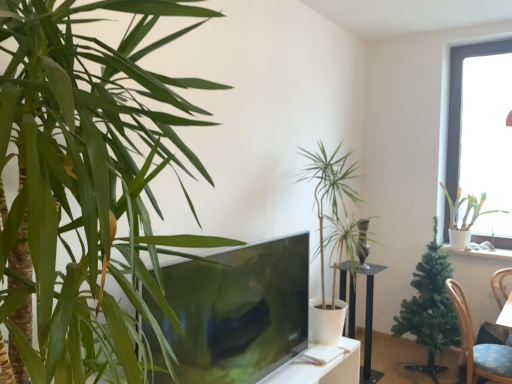
Find the location of a particular element. The image size is (512, 384). metallic black pedestal at center is located at coordinates (369, 326).

At what (x,y) coordinates should I click in order to perform the action: click on green leafy plant at left, positioned as the fourth houseplant in right-to-left order. Please return your answer as a coordinate pair (x, y). This screenshot has height=384, width=512. Looking at the image, I should click on (86, 185).

Image resolution: width=512 pixels, height=384 pixels. I want to click on transparent glass window at upper right, so click(x=482, y=134).

Locate an element on the screen. The height and width of the screenshot is (384, 512). white glossy pot at upper right, the first houseplant in the back-to-front sequence is located at coordinates (464, 216).

What do you see at coordinates (479, 345) in the screenshot? The width and height of the screenshot is (512, 384). I see `blue fabric chair at lower right` at bounding box center [479, 345].

Image resolution: width=512 pixels, height=384 pixels. In order to click on green leafy plant at center, which is the 3th houseplant from back to front in this screenshot , I will do pos(328,189).

Find the location of `metallic black pedestal at center`. metallic black pedestal at center is located at coordinates (369, 326).

Can you confirm if transparent glass window at upper right is wider than green artificial tree at right, placed as the 2th houseplant when sorted from back to front?

No, transparent glass window at upper right is not wider than green artificial tree at right, placed as the 2th houseplant when sorted from back to front.

Is transparent glass window at upper right next to green artificial tree at right, the 3th houseplant positioned from the left, and touching it?

No, transparent glass window at upper right is not touching green artificial tree at right, the 3th houseplant positioned from the left.

Can you tell me how much transparent glass window at upper right and green artificial tree at right, which appears as the third houseplant when viewed from the front, differ in facing direction?

0.414 degrees separate the facing orientations of transparent glass window at upper right and green artificial tree at right, which appears as the third houseplant when viewed from the front.

Which is in front, transparent glass window at upper right or green artificial tree at right, the 3th houseplant positioned from the left?

Positioned in front is green artificial tree at right, the 3th houseplant positioned from the left.

From the image's perspective, is white glossy pot at upper right, which appears as the 4th houseplant when viewed from the front, positioned above or below blue fabric chair at lower right?

white glossy pot at upper right, which appears as the 4th houseplant when viewed from the front, is situated higher than blue fabric chair at lower right in the image.

This screenshot has height=384, width=512. I want to click on chair on the left of white glossy pot at upper right, the first houseplant in the back-to-front sequence, so click(x=479, y=345).

Would you consider white glossy pot at upper right, which appears as the 4th houseplant when viewed from the front, to be distant from blue fabric chair at lower right?

Actually, white glossy pot at upper right, which appears as the 4th houseplant when viewed from the front, and blue fabric chair at lower right are a little close together.

Is green leafy plant at left, the 1th houseplant from the front, to the left of blue fabric chair at lower right from the viewer's perspective?

Yes, green leafy plant at left, the 1th houseplant from the front, is to the left of blue fabric chair at lower right.

From the image's perspective, which is above, green leafy plant at left, positioned as the fourth houseplant in right-to-left order, or blue fabric chair at lower right?

green leafy plant at left, positioned as the fourth houseplant in right-to-left order.

From the picture: In the image, is green leafy plant at left, which is the 1th houseplant in left-to-right order, positioned in front of or behind blue fabric chair at lower right?

green leafy plant at left, which is the 1th houseplant in left-to-right order, is in front of blue fabric chair at lower right.

Consider the image. In terms of width, does green leafy plant at left, the 4th houseplant from the back, look wider or thinner when compared to blue fabric chair at lower right?

Considering their sizes, green leafy plant at left, the 4th houseplant from the back, looks broader than blue fabric chair at lower right.

From the image's perspective, which is above, green leafy plant at left, which is the 1th houseplant in left-to-right order, or green artificial tree at right, placed as the 2th houseplant when sorted from back to front?

green leafy plant at left, which is the 1th houseplant in left-to-right order.

Who is smaller, green leafy plant at left, the 1th houseplant from the front, or green artificial tree at right, which appears as the third houseplant when viewed from the front?

green artificial tree at right, which appears as the third houseplant when viewed from the front.

Is green leafy plant at left, which is the 1th houseplant in left-to-right order, not near green artificial tree at right, arranged as the second houseplant when viewed from the right?

That's right, there is a large distance between green leafy plant at left, which is the 1th houseplant in left-to-right order, and green artificial tree at right, arranged as the second houseplant when viewed from the right.

Who is taller, green leafy plant at left, the 4th houseplant from the back, or green artificial tree at right, the 3th houseplant positioned from the left?

With more height is green leafy plant at left, the 4th houseplant from the back.

Choose the correct answer: Is green artificial tree at right, the 3th houseplant positioned from the left, inside metallic black pedestal at center or outside it?

green artificial tree at right, the 3th houseplant positioned from the left, cannot be found inside metallic black pedestal at center.

Does green artificial tree at right, arranged as the second houseplant when viewed from the right, come behind metallic black pedestal at center?

No, it is not.

Is green artificial tree at right, placed as the 2th houseplant when sorted from back to front, oriented towards metallic black pedestal at center?

No, green artificial tree at right, placed as the 2th houseplant when sorted from back to front, is not oriented towards metallic black pedestal at center.

Which object is positioned more to the right, green artificial tree at right, arranged as the second houseplant when viewed from the right, or metallic black pedestal at center?

green artificial tree at right, arranged as the second houseplant when viewed from the right.

How distant is transparent glass window at upper right from green leafy plant at center, the second houseplant from the front?

transparent glass window at upper right is 1.26 meters away from green leafy plant at center, the second houseplant from the front.

Are transparent glass window at upper right and green leafy plant at center, which ranks as the third houseplant in right-to-left order, located far from each other?

Yes.

Between transparent glass window at upper right and green leafy plant at center, which appears as the 2th houseplant when viewed from the left, which one has smaller width?

With smaller width is transparent glass window at upper right.

Is transparent glass window at upper right aimed at green leafy plant at center, which ranks as the third houseplant in right-to-left order?

No, transparent glass window at upper right is not aimed at green leafy plant at center, which ranks as the third houseplant in right-to-left order.

How far apart are green leafy plant at center, which is the 3th houseplant from back to front, and white glossy pot at upper right, the fourth houseplant viewed from the left?

green leafy plant at center, which is the 3th houseplant from back to front, is 1.18 meters away from white glossy pot at upper right, the fourth houseplant viewed from the left.

Is green leafy plant at center, which appears as the 2th houseplant when viewed from the left, taller or shorter than white glossy pot at upper right, the first houseplant viewed from the right?

In the image, green leafy plant at center, which appears as the 2th houseplant when viewed from the left, appears to be taller than white glossy pot at upper right, the first houseplant viewed from the right.

Considering the sizes of objects green leafy plant at center, which is the 3th houseplant from back to front, and white glossy pot at upper right, the first houseplant in the back-to-front sequence, in the image provided, who is thinner, green leafy plant at center, which is the 3th houseplant from back to front, or white glossy pot at upper right, the first houseplant in the back-to-front sequence,?

white glossy pot at upper right, the first houseplant in the back-to-front sequence.

From a real-world perspective, between green leafy plant at center, which ranks as the third houseplant in right-to-left order, and white glossy pot at upper right, the first houseplant in the back-to-front sequence, who is vertically lower?

From a 3D spatial view, green leafy plant at center, which ranks as the third houseplant in right-to-left order, is below.

From a real-world perspective, which houseplant is the 4th one underneath the transparent glass window at upper right? Please provide its 2D coordinates.

[(430, 308)]

The image size is (512, 384). Find the location of `houseplant on the right of blue fabric chair at lower right`. houseplant on the right of blue fabric chair at lower right is located at coordinates (464, 216).

When comparing their distances from blue fabric chair at lower right, does green artificial tree at right, the 3th houseplant positioned from the left, or green leafy plant at center, which ranks as the third houseplant in right-to-left order, seem closer?

green artificial tree at right, the 3th houseplant positioned from the left, lies closer to blue fabric chair at lower right than the other object.

Looking at the image, which one is located closer to transparent glass window at upper right, white glossy pot at upper right, the first houseplant viewed from the right, or blue fabric chair at lower right?

white glossy pot at upper right, the first houseplant viewed from the right, is closer to transparent glass window at upper right.

Looking at the image, which one is located closer to metallic black pedestal at center, blue fabric chair at lower right or white glossy pot at upper right, the first houseplant in the back-to-front sequence?

The object closer to metallic black pedestal at center is blue fabric chair at lower right.

Considering their positions, is matte black tv at center positioned further to transparent glass window at upper right than blue fabric chair at lower right?

matte black tv at center is further to transparent glass window at upper right.

Looking at the image, which one is located closer to white glossy pot at upper right, the fourth houseplant viewed from the left, green leafy plant at left, the 1th houseplant from the front, or green leafy plant at center, which appears as the 2th houseplant when viewed from the left?

green leafy plant at center, which appears as the 2th houseplant when viewed from the left, is closer to white glossy pot at upper right, the fourth houseplant viewed from the left.

Based on their spatial positions, is green artificial tree at right, the 3th houseplant positioned from the left, or matte black tv at center closer to transparent glass window at upper right?

Based on the image, green artificial tree at right, the 3th houseplant positioned from the left, appears to be nearer to transparent glass window at upper right.

Considering their positions, is green artificial tree at right, placed as the 2th houseplant when sorted from back to front, positioned further to metallic black pedestal at center than blue fabric chair at lower right?

The object further to metallic black pedestal at center is blue fabric chair at lower right.

Based on their spatial positions, is green leafy plant at center, which is the 3th houseplant from back to front, or blue fabric chair at lower right closer to matte black tv at center?

Among the two, green leafy plant at center, which is the 3th houseplant from back to front, is located nearer to matte black tv at center.

Locate an element on the screen. chair between transparent glass window at upper right and metallic black pedestal at center from top to bottom is located at coordinates (479, 345).

Where is `houseplant between metallic black pedestal at center and white glossy pot at upper right, the first houseplant in the back-to-front sequence, from left to right`? This screenshot has width=512, height=384. houseplant between metallic black pedestal at center and white glossy pot at upper right, the first houseplant in the back-to-front sequence, from left to right is located at coordinates (430, 308).

The width and height of the screenshot is (512, 384). What are the coordinates of `chair located between matte black tv at center and transparent glass window at upper right in the left-right direction` in the screenshot? It's located at (479, 345).

I want to click on houseplant between matte black tv at center and green artificial tree at right, arranged as the second houseplant when viewed from the right, from left to right, so click(328, 189).